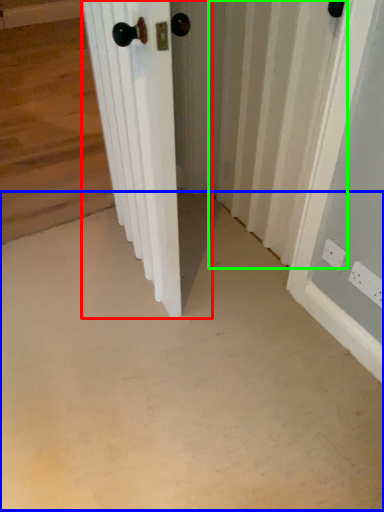
Question: Which object is positioned farthest from door (highlighted by a red box)? Select from concrete (highlighted by a blue box) and radiator (highlighted by a green box).

Choices:
 (A) concrete
 (B) radiator

Answer: (B)